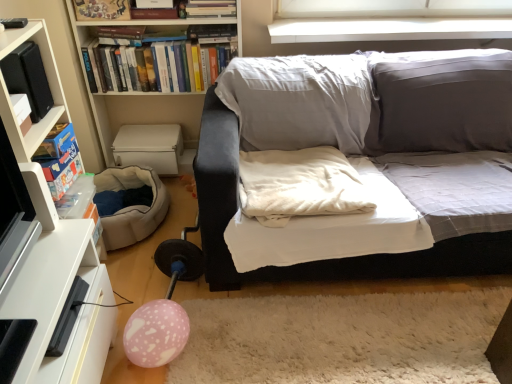
Question: From the image's perspective, is black matte speaker at left, the third paperback book in the bottom-to-top sequence, positioned above or below white glossy tv stand at lower left?

Choices:
 (A) below
 (B) above

Answer: (B)

Question: Is point (28, 51) positioned closer to the camera than point (83, 344)?

Choices:
 (A) farther
 (B) closer

Answer: (A)

Question: Based on their relative distances, which object is nearer to the white plastic bookshelf at upper left, the 2th cabinetry when ordered from front to back?

Choices:
 (A) white glossy cabinet at left, arranged as the first cabinetry when viewed from the front
 (B) beige fabric bean bag at lower left
 (C) pink matte balloon at lower left
 (D) white fluffy rug at lower center
 (E) white soft pillow at center

Answer: (B)

Question: Which object is positioned closest to the white soft pillow at center?

Choices:
 (A) white fluffy rug at lower center
 (B) white glossy tv stand at lower left
 (C) pink matte balloon at lower left
 (D) hardcover books at upper left, positioned as the first book in back-to-front order
 (E) blue cardboard game box at left, which is the 3th paperback book in top-to-bottom order

Answer: (A)